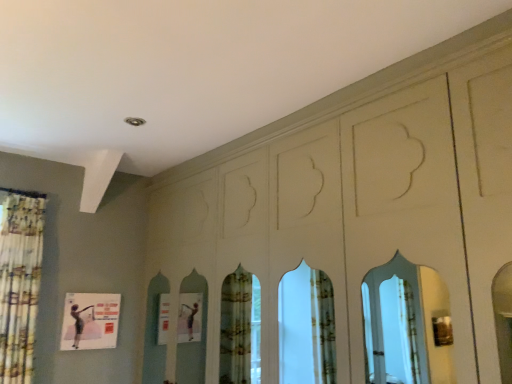
Question: From the image's perspective, is floral fabric shower curtain at left above or below matte pink poster at lower left?

Choices:
 (A) below
 (B) above

Answer: (B)

Question: From a real-world perspective, is floral fabric shower curtain at left physically located above or below matte pink poster at lower left?

Choices:
 (A) below
 (B) above

Answer: (B)

Question: Looking at the image, does floral fabric shower curtain at left seem bigger or smaller compared to matte pink poster at lower left?

Choices:
 (A) small
 (B) big

Answer: (B)

Question: From a real-world perspective, is matte pink poster at lower left physically located above or below floral fabric shower curtain at left?

Choices:
 (A) below
 (B) above

Answer: (A)

Question: Is matte pink poster at lower left bigger or smaller than floral fabric shower curtain at left?

Choices:
 (A) big
 (B) small

Answer: (B)

Question: In terms of height, does matte pink poster at lower left look taller or shorter compared to floral fabric shower curtain at left?

Choices:
 (A) short
 (B) tall

Answer: (A)

Question: Is point (113, 311) closer or farther from the camera than point (12, 196)?

Choices:
 (A) farther
 (B) closer

Answer: (A)